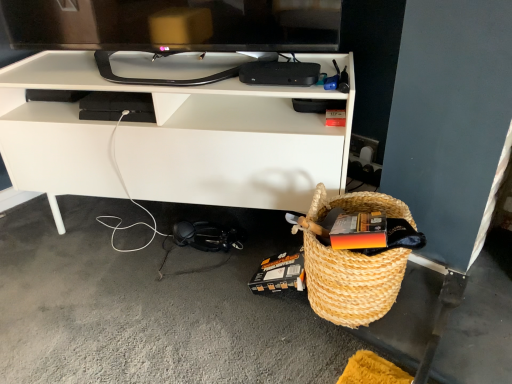
Question: In the image, is white matte desk at center on the left side or the right side of black glossy tv at upper center?

Choices:
 (A) right
 (B) left

Answer: (A)

Question: Considering the positions of white matte desk at center and black glossy tv at upper center in the image, is white matte desk at center taller or shorter than black glossy tv at upper center?

Choices:
 (A) tall
 (B) short

Answer: (A)

Question: Which of these objects is positioned farthest from the natural woven picnic basket at lower right?

Choices:
 (A) black glossy tv at upper center
 (B) white matte desk at center

Answer: (A)

Question: Based on their relative distances, which object is nearer to the white matte desk at center?

Choices:
 (A) black glossy tv at upper center
 (B) natural woven picnic basket at lower right

Answer: (A)